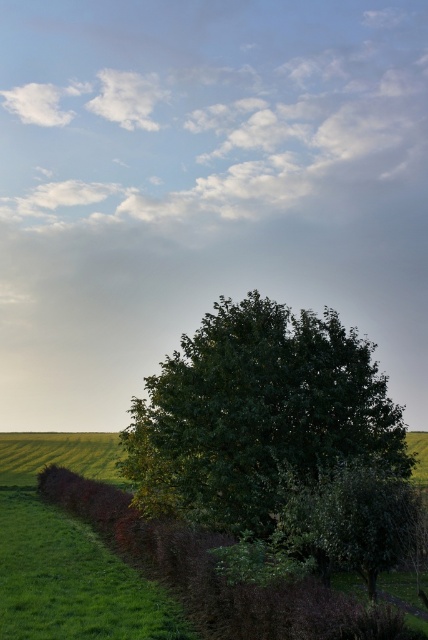
Question: Which point appears closest to the camera in this image?

Choices:
 (A) (225, 428)
 (B) (76, 488)

Answer: (A)

Question: Which point is closer to the camera?

Choices:
 (A) (237, 321)
 (B) (67, 506)

Answer: (A)

Question: Can you confirm if green leafy tree at center is smaller than brown textured hedge at lower left?

Choices:
 (A) yes
 (B) no

Answer: (A)

Question: Can you confirm if green leafy tree at center is wider than brown textured hedge at lower left?

Choices:
 (A) no
 (B) yes

Answer: (A)

Question: Does green leafy tree at center appear on the left side of brown textured hedge at lower left?

Choices:
 (A) no
 (B) yes

Answer: (A)